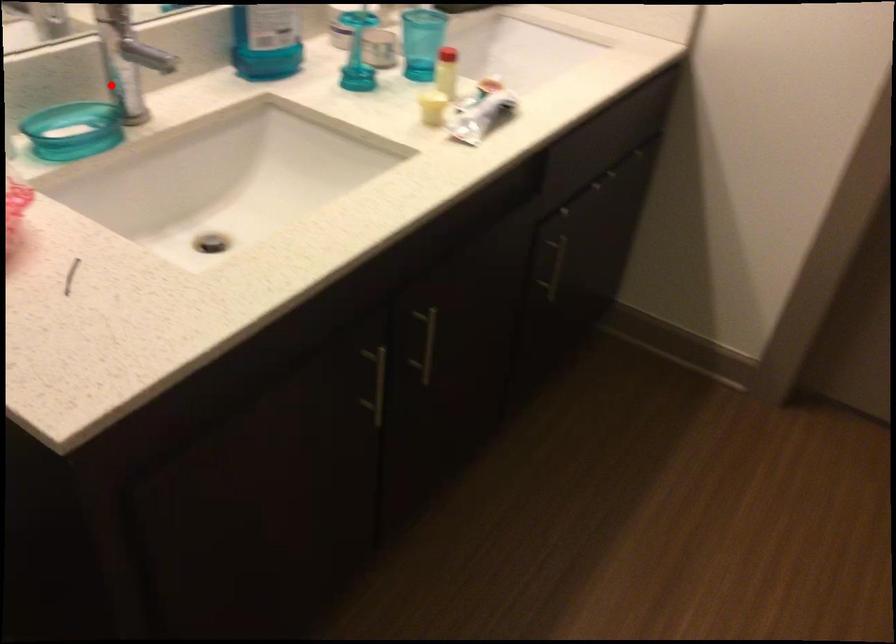
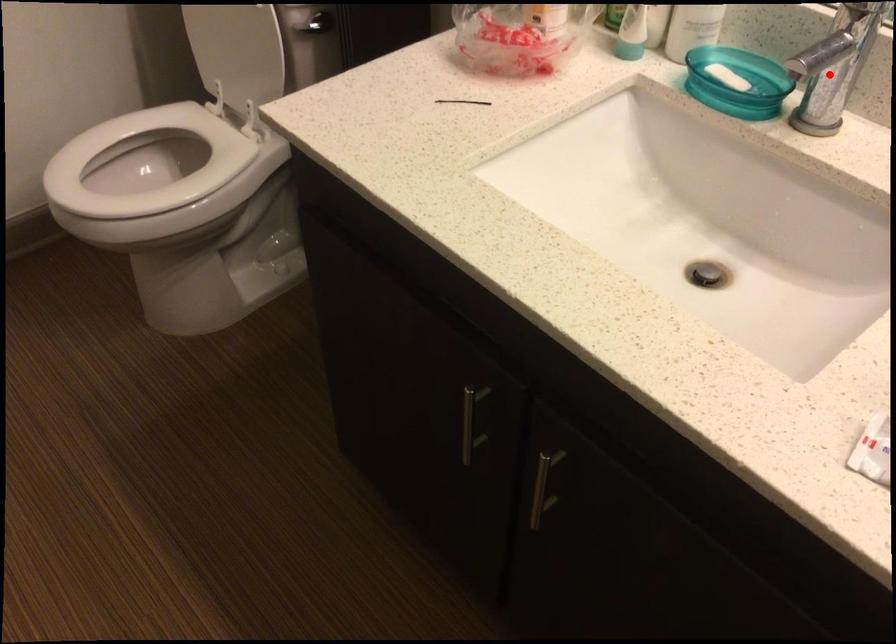
I am providing you with two images of the same scene from different viewpoints. A red point is marked on the first image and another point is marked on the second image. Do the highlighted points in image1 and image2 indicate the same real-world spot?

Yes